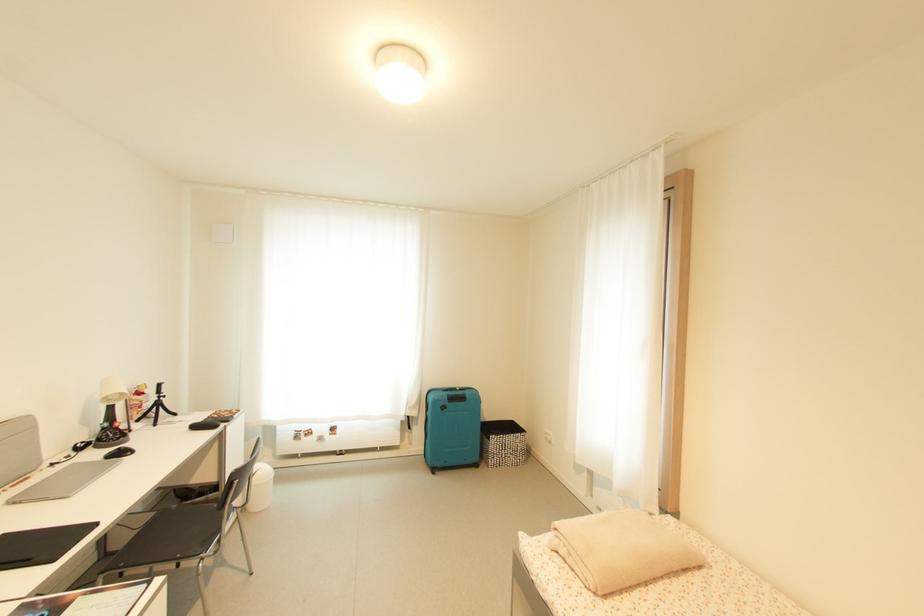
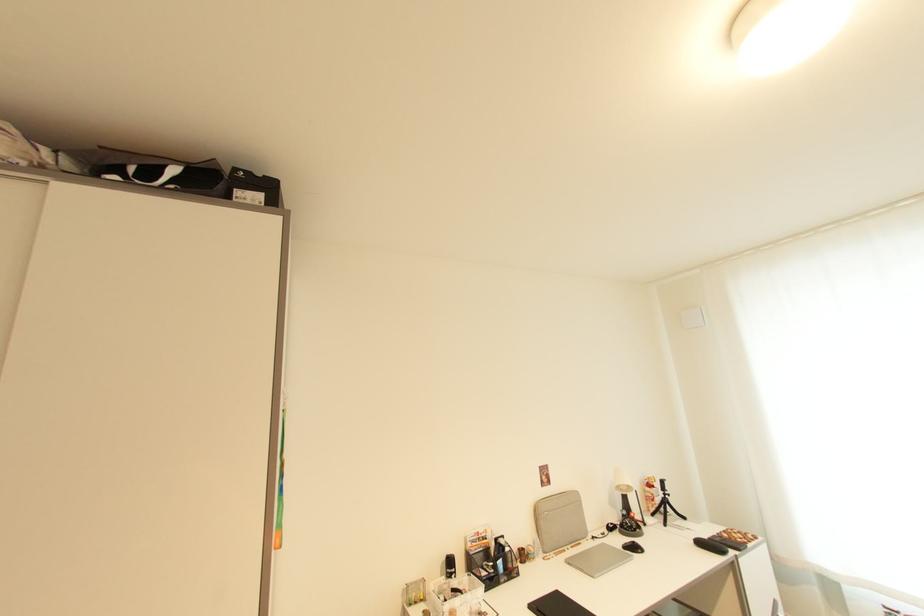
Locate, in the second image, the point that corresponds to pixel 127 455 in the first image.

(639, 549)